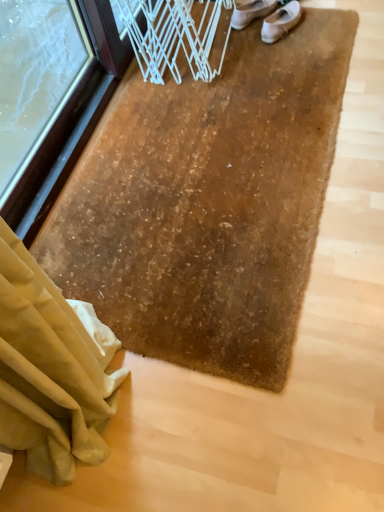
Question: Considering the positions of white leather shoe at upper center, placed as the second footwear when sorted from right to left, and white leather shoes at upper center, the second footwear positioned from the left, in the image, is white leather shoe at upper center, placed as the second footwear when sorted from right to left, bigger or smaller than white leather shoes at upper center, the second footwear positioned from the left,?

Choices:
 (A) big
 (B) small

Answer: (B)

Question: Considering the relative positions of white leather shoe at upper center, placed as the second footwear when sorted from right to left, and white leather shoes at upper center, which is the 1th footwear in right-to-left order, in the image provided, is white leather shoe at upper center, placed as the second footwear when sorted from right to left, to the left or to the right of white leather shoes at upper center, which is the 1th footwear in right-to-left order,?

Choices:
 (A) left
 (B) right

Answer: (A)

Question: Does point (x=256, y=15) appear closer or farther from the camera than point (x=261, y=33)?

Choices:
 (A) farther
 (B) closer

Answer: (A)

Question: In terms of height, does white leather shoes at upper center, which is the 1th footwear in right-to-left order, look taller or shorter compared to white leather shoe at upper center, placed as the second footwear when sorted from right to left?

Choices:
 (A) tall
 (B) short

Answer: (B)

Question: Is point (281, 12) closer or farther from the camera than point (268, 0)?

Choices:
 (A) farther
 (B) closer

Answer: (B)

Question: From the image's perspective, is white leather shoes at upper center, the second footwear positioned from the left, located above or below white leather shoe at upper center, the first footwear from the left?

Choices:
 (A) above
 (B) below

Answer: (B)

Question: From a real-world perspective, relative to white leather shoe at upper center, placed as the second footwear when sorted from right to left, is white leather shoes at upper center, which is the 1th footwear in right-to-left order, vertically above or below?

Choices:
 (A) above
 (B) below

Answer: (A)